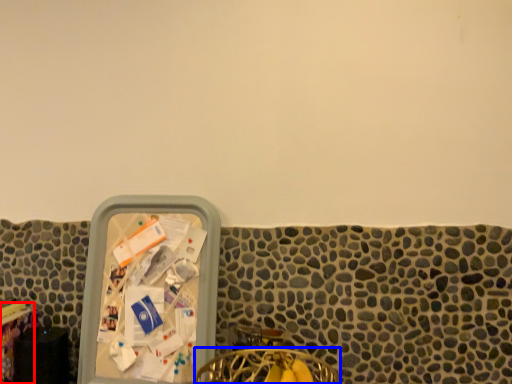
Question: Among these objects, which one is nearest to the camera, table (highlighted by a red box) or chair (highlighted by a blue box)?

Choices:
 (A) table
 (B) chair

Answer: (B)